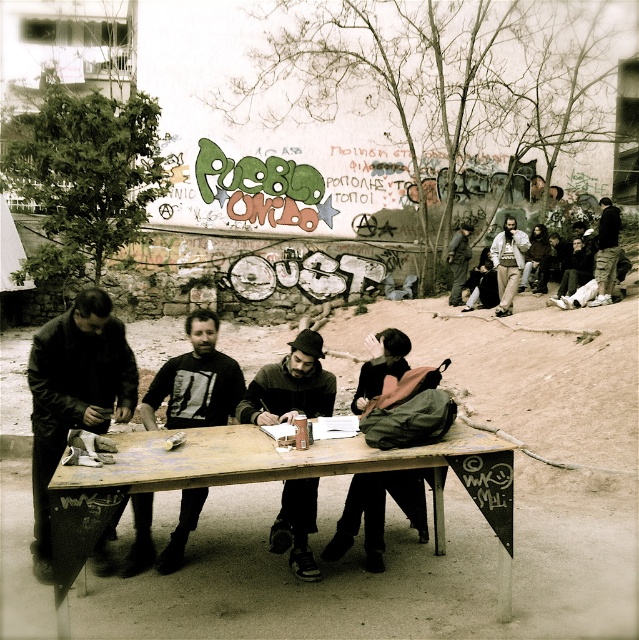
Who is taller, dark gray sweater at center or beige fabric jacket at upper right?

Standing taller between the two is beige fabric jacket at upper right.

Does dark gray sweater at center have a lesser width compared to beige fabric jacket at upper right?

Yes.

Is point (275, 525) behind point (498, 269)?

No, it is not.

Image resolution: width=639 pixels, height=640 pixels. In order to click on dark gray sweater at center in this screenshot , I will do `click(289, 385)`.

What do you see at coordinates (196, 380) in the screenshot? The width and height of the screenshot is (639, 640). I see `black matte shirt at center` at bounding box center [196, 380].

Is black matte shirt at center to the right of dark green backpack at center from the viewer's perspective?

In fact, black matte shirt at center is to the left of dark green backpack at center.

This screenshot has width=639, height=640. What are the coordinates of `black matte shirt at center` in the screenshot? It's located at (196, 380).

Between dark gray sweater at center and dark green backpack at center, which one appears on the left side from the viewer's perspective?

dark gray sweater at center is more to the left.

Locate an element on the screen. This screenshot has width=639, height=640. dark gray sweater at center is located at coordinates (289, 385).

Who is more distant from viewer, [316,371] or [420,532]?

The point [420,532] is behind.

At what (x,y) coordinates should I click in order to perform the action: click on dark gray sweater at center. Please return your answer as a coordinate pair (x, y). Looking at the image, I should click on (289, 385).